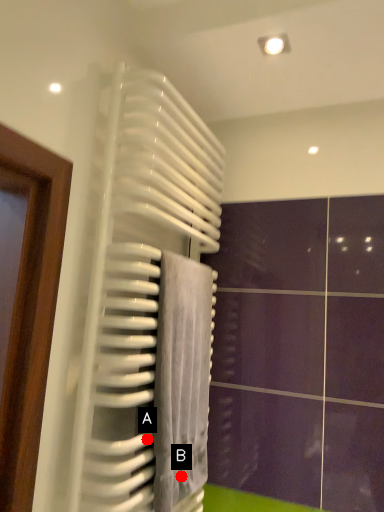
Question: Two points are circled on the image, labeled by A and B beside each circle. Which point is farther from the camera taking this photo?

Choices:
 (A) A is further
 (B) B is further

Answer: (B)